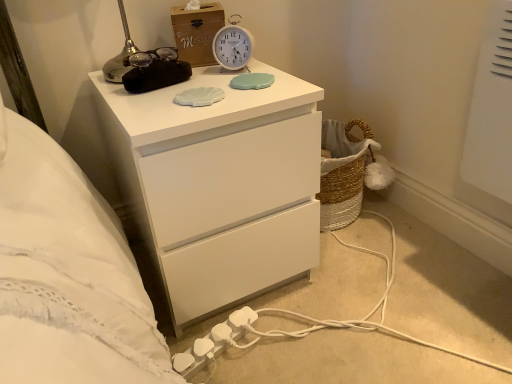
This screenshot has height=384, width=512. In order to click on vacant area that lies to the right of white matte chest of drawers at upper center in this screenshot , I will do `click(380, 283)`.